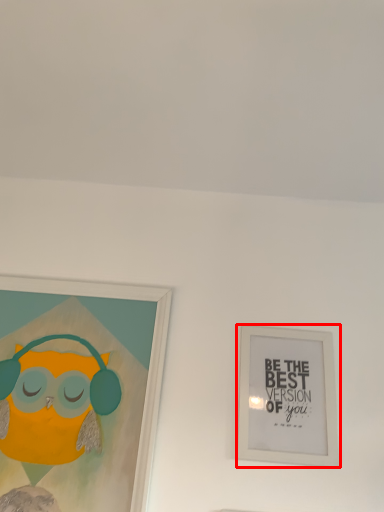
Question: From the image's perspective, what is the correct spatial positioning of picture frame (annotated by the red box) in reference to picture frame?

Choices:
 (A) below
 (B) above

Answer: (A)